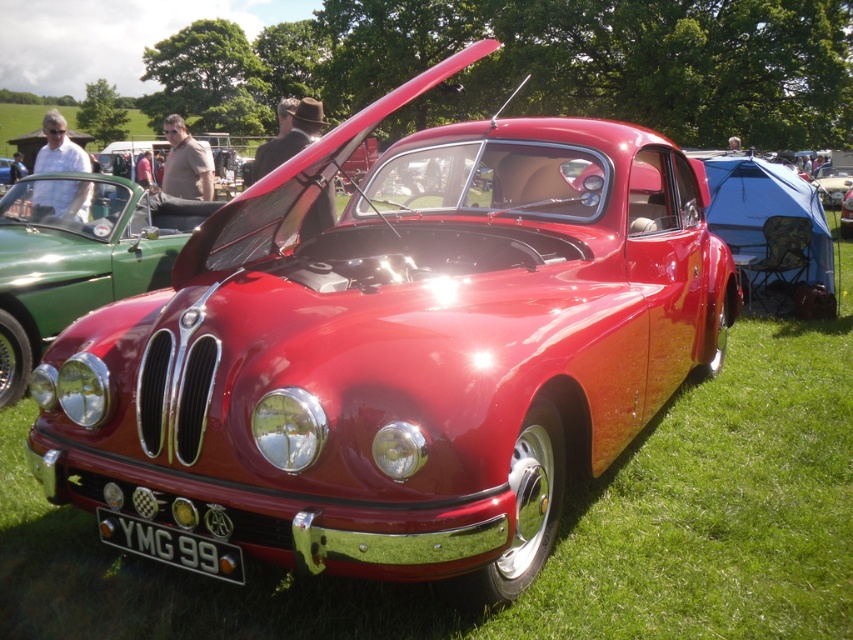
Question: Which of these objects is positioned farthest from the matte black car at center?

Choices:
 (A) shiny chrome grille at center
 (B) black metallic license plate at center
 (C) shiny red car at center

Answer: (C)

Question: Does black metallic license plate at center appear on the left side of shiny red car at center?

Choices:
 (A) no
 (B) yes

Answer: (B)

Question: Which is nearer to the shiny chrome grille at center?

Choices:
 (A) shiny red car at center
 (B) matte black car at center

Answer: (A)

Question: Where is shiny chrome grille at center located in relation to shiny red car at center in the image?

Choices:
 (A) above
 (B) below

Answer: (B)

Question: Which of the following is the closest to the observer?

Choices:
 (A) (846, 225)
 (B) (218, 547)

Answer: (B)

Question: Is shiny chrome grille at center to the right of matte black car at center from the viewer's perspective?

Choices:
 (A) no
 (B) yes

Answer: (B)